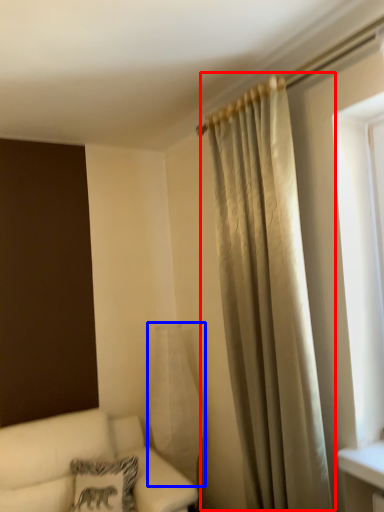
Question: Which point is closer to the camera, curtain (highlighted by a red box) or glass vase (highlighted by a blue box)?

Choices:
 (A) curtain
 (B) glass vase

Answer: (A)